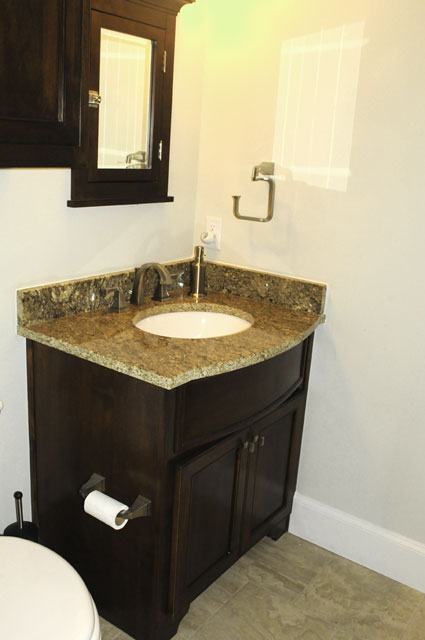
The image size is (425, 640). I want to click on cabinet drawers, so click(x=23, y=66).